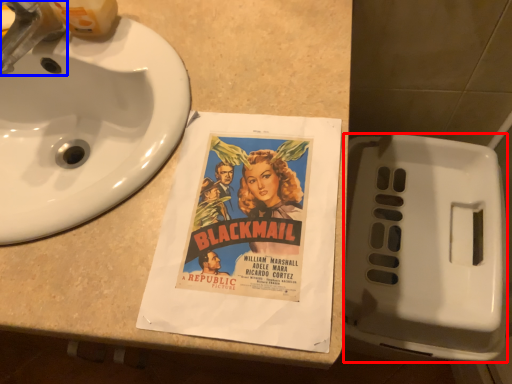
Question: Which of the following is the farthest to the observer, toilet (highlighted by a red box) or faucet (highlighted by a blue box)?

Choices:
 (A) toilet
 (B) faucet

Answer: (A)